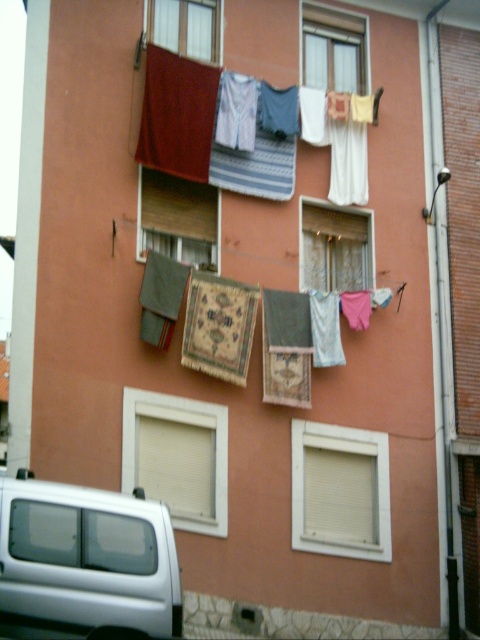
Question: Can you confirm if silver metallic van at lower left is positioned to the left of wooden at center?

Choices:
 (A) no
 (B) yes

Answer: (B)

Question: From the image, what is the correct spatial relationship of patterned carpet at center in relation to wooden at center?

Choices:
 (A) right
 (B) left

Answer: (A)

Question: Among these points, which one is farthest from the camera?

Choices:
 (A) (344, 36)
 (B) (240, 332)
 (C) (156, 93)

Answer: (A)

Question: Which object appears farthest from the camera in this image?

Choices:
 (A) transparent glass window at upper center
 (B) wooden at center
 (C) silver metallic van at lower left
 (D) white matte window at lower left

Answer: (A)

Question: Which object is positioned farthest from the white matte window at lower center?

Choices:
 (A) silver metallic van at lower left
 (B) transparent glass window at upper center

Answer: (A)

Question: Does silver metallic van at lower left lie in front of white fabric at center?

Choices:
 (A) yes
 (B) no

Answer: (A)